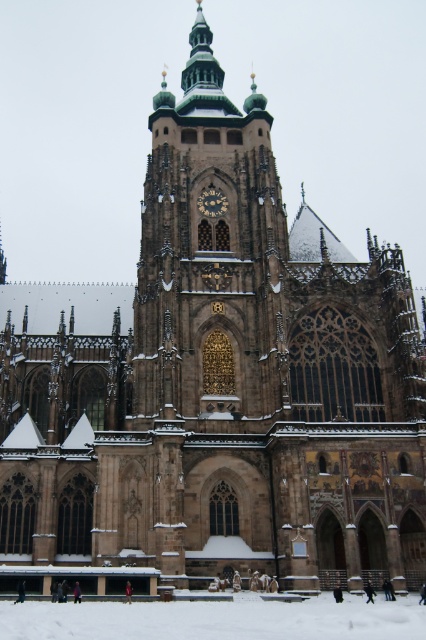
In the scene shown: You are standing in front of the cathedral and want to take a photo of the brown stone tower at center. If your camera can only focus on objects within a 0.5 meter radius around the center point of the image, which is at coordinates 0.5, 0.5, will the tower be in focus?

The brown stone tower at center is positioned at coordinates (210, 256), which is within the 0.5 meter radius of the center point (213, 320). Therefore, the tower will be in focus.

You are a drone operator tasked with capturing aerial footage of the brown stone tower at center and the white powdery snow at lower center. The drone has a maximum flight range of 25 meters. Can the drone safely capture footage of both locations without exceeding its range limit?

The brown stone tower at center and the white powdery snow at lower center are 25.43 meters apart, which exceeds the drone operator maximum flight range of 25 meters. The drone cannot safely capture footage of both locations without exceeding its range limit.